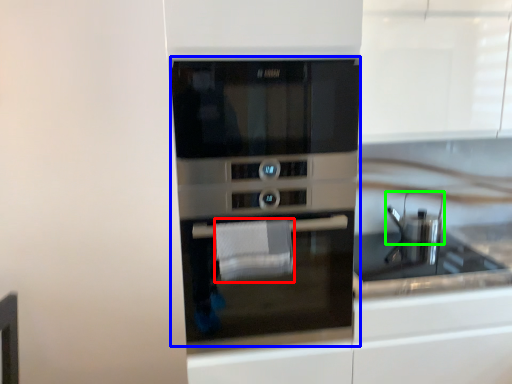
Question: Based on their relative distances, which object is nearer to hand towel (highlighted by a red box)? Choose from oven (highlighted by a blue box) and appliance (highlighted by a green box).

Choices:
 (A) oven
 (B) appliance

Answer: (A)